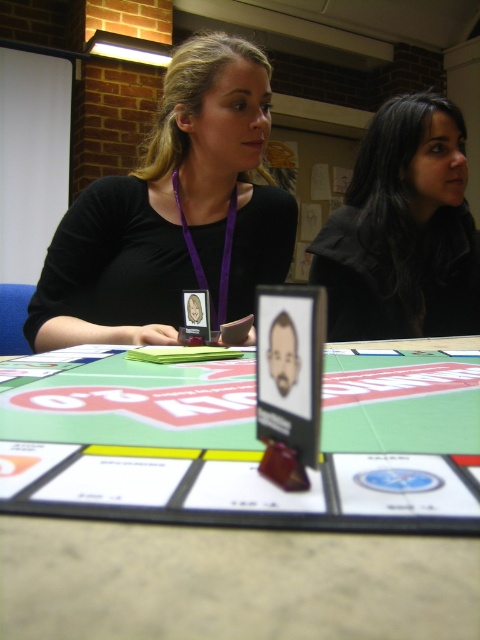
You are a game designer observing the board game session. You need to determine if the green board game at center can be moved closer to the matte black lanyard at center without overlapping. Based on their current positions, can this adjustment be made?

The green board game at center is currently in front of the matte black lanyard at center, meaning there is space between them. Therefore, moving the board game closer to the lanyard would require adjusting their positions, but since they are already aligned along the same axis, it might not be possible without overlapping unless there is additional space available. However, based solely on the provided description, we cannot confirm the exact spatial dimensions required for this adjustment.

From the picture: You are a photographer trying to capture a candid shot of the black matte hair at upper right without it being blocked by the green board game at center. Based on the scene, can you position yourself in a way to avoid the obstruction?

The green board game at center is positioned under the black matte hair at upper right, so if you position yourself slightly above or to the side of the game, you should be able to capture the black matte hair at upper right without obstruction.